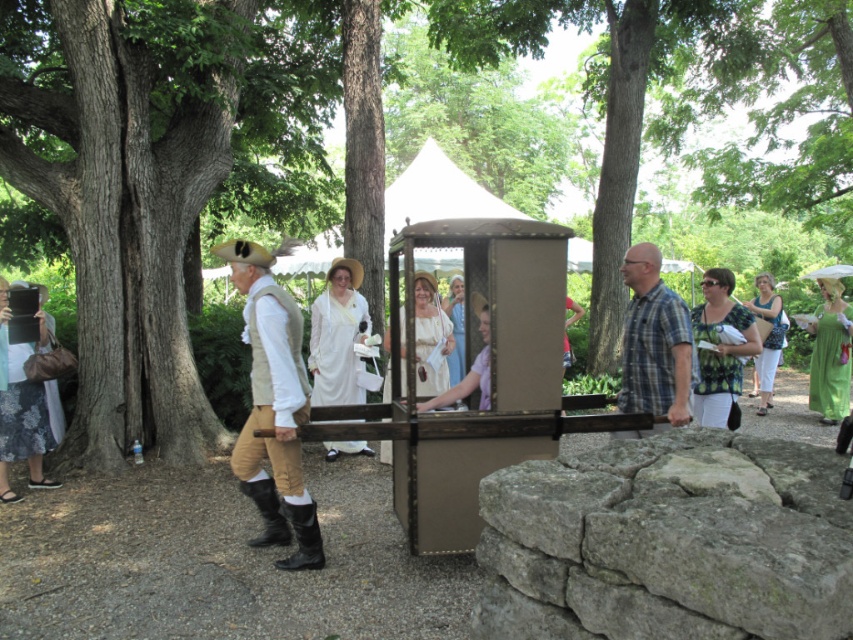
Question: Is brown rough tree trunk at center thinner than light brown leather pants at center?

Choices:
 (A) no
 (B) yes

Answer: (A)

Question: Among these objects, which one is nearest to the camera?

Choices:
 (A) light brown leather pants at center
 (B) green cotton dress at right

Answer: (A)

Question: Does brown rough tree trunk at center have a lesser width compared to green printed blouse at center?

Choices:
 (A) no
 (B) yes

Answer: (A)

Question: Does blue plaid shirt at center appear over green satin dress at right?

Choices:
 (A) yes
 (B) no

Answer: (A)

Question: Which point appears farthest from the camera in this image?

Choices:
 (A) (84, 330)
 (B) (279, 336)

Answer: (A)

Question: Among these points, which one is farthest from the camera?

Choices:
 (A) (277, 339)
 (B) (646, 58)
 (C) (830, 368)

Answer: (B)